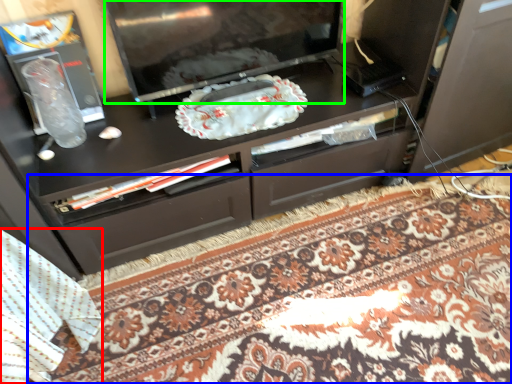
Question: Which object is positioned closest to blanket (highlighted by a red box)? Select from mat (highlighted by a blue box) and television (highlighted by a green box).

Choices:
 (A) mat
 (B) television

Answer: (A)